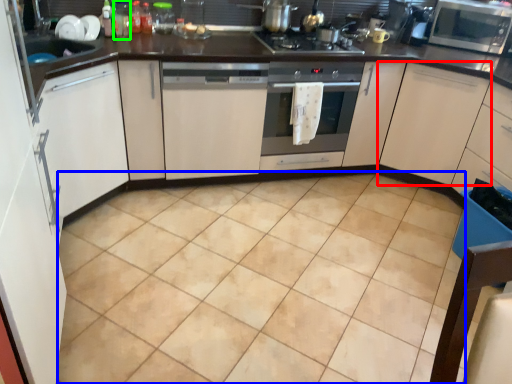
Question: Which object is positioned farthest from cabinetry (highlighted by a red box)? Select from ceramic tile (highlighted by a blue box) and bottle (highlighted by a green box).

Choices:
 (A) ceramic tile
 (B) bottle

Answer: (B)